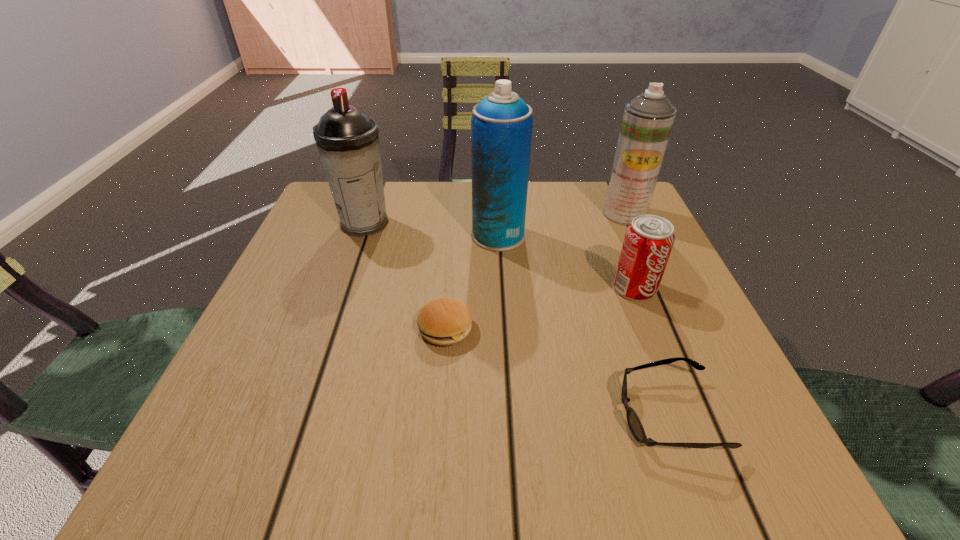
What are the coordinates of `object that is at the far left corner` in the screenshot? It's located at (347, 139).

Find the location of a particular element. The height and width of the screenshot is (540, 960). object that is at the far right corner is located at coordinates (647, 121).

I want to click on object located at the near right corner, so click(634, 423).

This screenshot has height=540, width=960. Identify the location of vacant position at the far edge of the desktop. (414, 219).

Locate an element on the screen. free space at the near edge of the desktop is located at coordinates (612, 479).

Find the location of a particular element. The width and height of the screenshot is (960, 540). vacant space at the left edge of the desktop is located at coordinates (329, 339).

Image resolution: width=960 pixels, height=540 pixels. In the image, there is a desktop. Find the location of `blank space at the right edge`. blank space at the right edge is located at coordinates (692, 410).

Image resolution: width=960 pixels, height=540 pixels. In order to click on vacant point located between the leftmost aerosol can and the patty in this screenshot , I will do `click(405, 276)`.

What are the coordinates of `free space that is in between the leftmost object and the second aerosol can from right to left` in the screenshot? It's located at (431, 230).

Find the location of `free space between the patty and the second aerosol can from right to left`. free space between the patty and the second aerosol can from right to left is located at coordinates (472, 282).